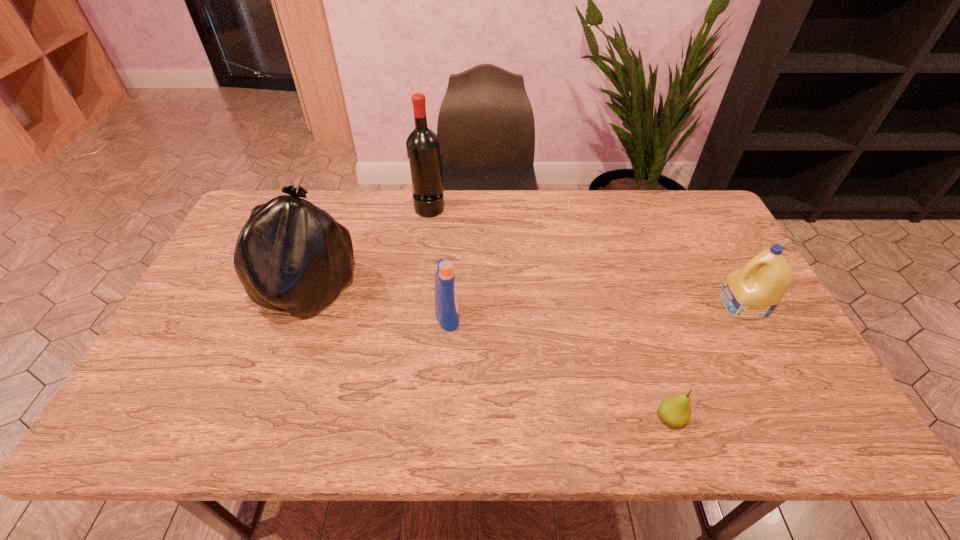
Where is `vacant space situated 0.250m on the label of the left detergent`? The width and height of the screenshot is (960, 540). vacant space situated 0.250m on the label of the left detergent is located at coordinates 552,315.

I want to click on vacant space located 0.280m on the label of the rightmost object, so click(621, 306).

The image size is (960, 540). I want to click on vacant region located on the label of the rightmost object, so click(591, 306).

The image size is (960, 540). Identify the location of vacant space located on the label of the rightmost object. (606, 306).

Find the location of a particular element. vacant space located 0.250m on the right of the pear is located at coordinates (798, 419).

Identify the location of object located at the far edge. (423, 146).

Where is `object that is at the near edge`? The image size is (960, 540). object that is at the near edge is located at coordinates tap(676, 411).

Locate an element on the screen. object at the left edge is located at coordinates (291, 255).

In order to click on object present at the right edge in this screenshot , I will do `click(752, 292)`.

At what (x,y) coordinates should I click in order to perform the action: click on free space at the far edge of the desktop. Please return your answer as a coordinate pair (x, y). The height and width of the screenshot is (540, 960). Looking at the image, I should click on (617, 204).